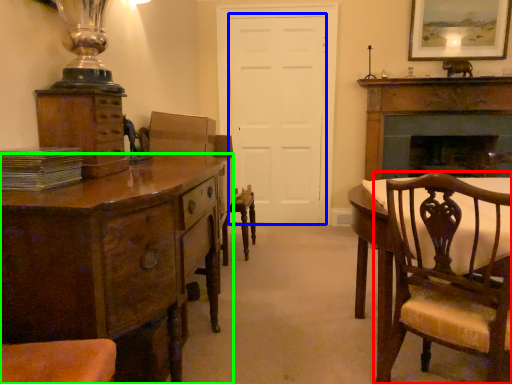
Question: Estimate the real-world distances between objects in this image. Which object is farther from chair (highlighted by a red box), door (highlighted by a blue box) or chest of drawers (highlighted by a green box)?

Choices:
 (A) door
 (B) chest of drawers

Answer: (A)